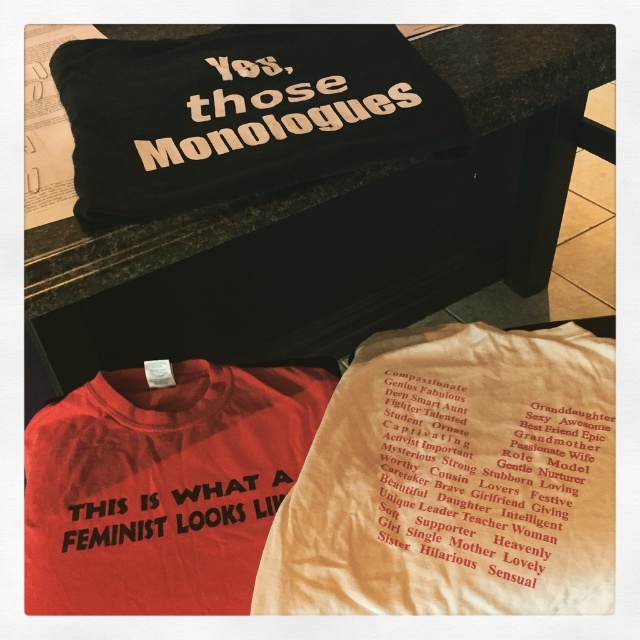
The height and width of the screenshot is (640, 640). I want to click on black fabric pillow at upper center, so click(x=337, y=228).

Consider the image. Can you confirm if black fabric pillow at upper center is taller than black fabric text at center?

Indeed, black fabric pillow at upper center has a greater height compared to black fabric text at center.

The width and height of the screenshot is (640, 640). What do you see at coordinates (337, 228) in the screenshot?
I see `black fabric pillow at upper center` at bounding box center [337, 228].

Locate an element on the screen. This screenshot has width=640, height=640. black fabric pillow at upper center is located at coordinates (337, 228).

Which of these two, red cotton t-shirt at center or wooden text at center, stands taller?

red cotton t-shirt at center

Does red cotton t-shirt at center have a lesser width compared to wooden text at center?

Incorrect, red cotton t-shirt at center's width is not less than wooden text at center's.

Where is `red cotton t-shirt at center`? This screenshot has height=640, width=640. red cotton t-shirt at center is located at coordinates (163, 486).

Is wooden text at center shorter than black fabric text at center?

In fact, wooden text at center may be taller than black fabric text at center.

Can you confirm if wooden text at center is taller than black fabric text at center?

Yes, wooden text at center is taller than black fabric text at center.

Measure the distance between point (320, 115) and camera.

Point (320, 115) and camera are 31.56 inches apart from each other.

Where is `wooden text at center`? Image resolution: width=640 pixels, height=640 pixels. wooden text at center is located at coordinates (275, 128).